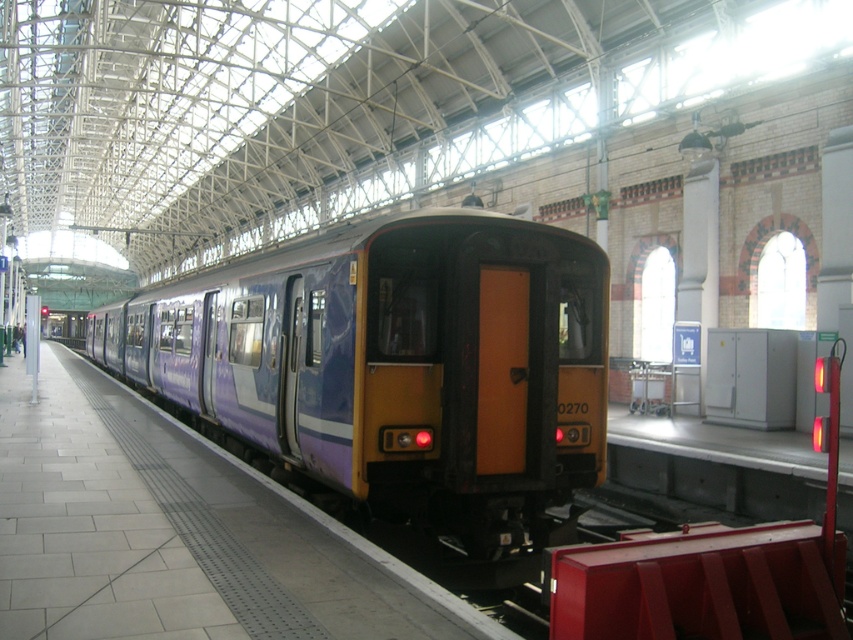
Is purple matte train at center shorter than purple glossy platform at center?

No.

Is point (189, 333) farther from camera compared to point (140, 579)?

Yes, it is.

The image size is (853, 640). Identify the location of purple matte train at center. (396, 364).